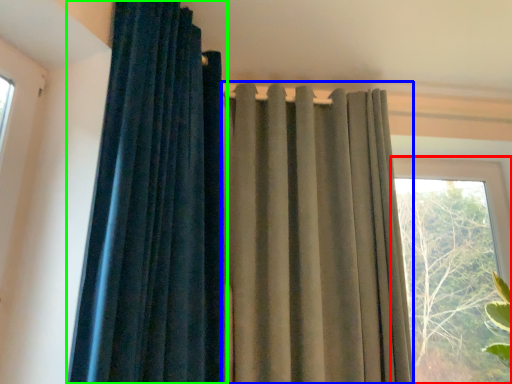
Question: Based on their relative distances, which object is nearer to window (highlighted by a red box)? Choose from curtain (highlighted by a blue box) and curtain (highlighted by a green box).

Choices:
 (A) curtain
 (B) curtain

Answer: (A)